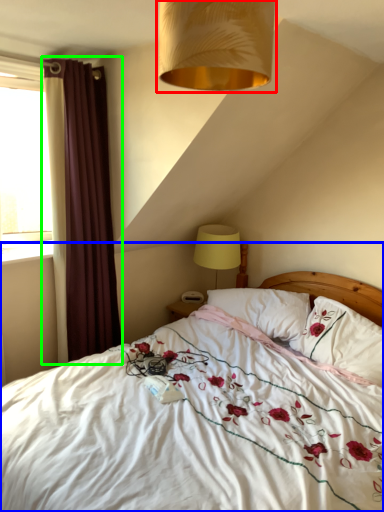
Question: Considering the real-world distances, which object is farthest from lamp (highlighted by a red box)? bed (highlighted by a blue box) or curtain (highlighted by a green box)?

Choices:
 (A) bed
 (B) curtain

Answer: (B)